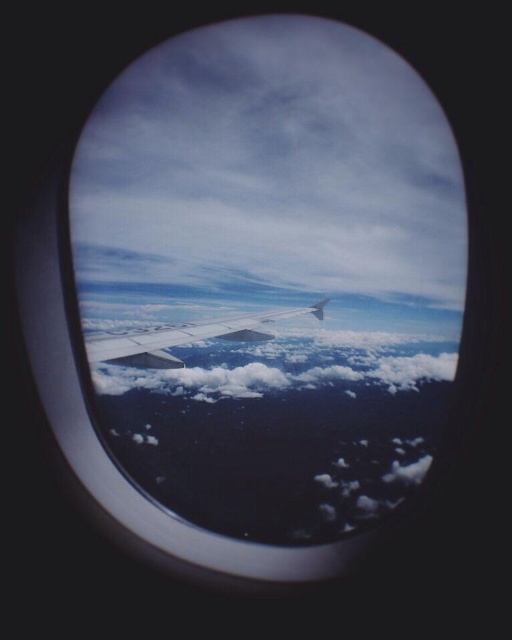
You are a pilot checking the clouds outside your airplane window. You notice a point marked at coordinates (x=281, y=365). What type of cloud is located at this point?

The point marked at coordinates (x=281, y=365) indicates a white fluffy cloud at center.

You are a pilot flying at an altitude of 30,000 feet. You notice a white fluffy cloud at center and a metallic silver wing at center. How far apart are these two objects in feet?

The distance between the white fluffy cloud at center and the metallic silver wing at center is 881.64 feet.